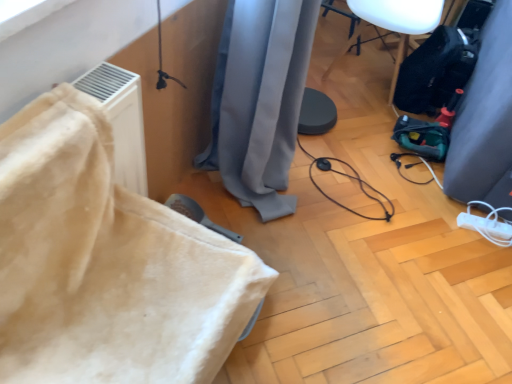
Question: In terms of height, does beige fabric couch at left, marked as the 1th furniture in a front-to-back arrangement, look taller or shorter compared to black plastic speaker at upper right, which is the 1th furniture from right to left?

Choices:
 (A) short
 (B) tall

Answer: (A)

Question: Is beige fabric couch at left, arranged as the first furniture when viewed from the left, in front of or behind black plastic speaker at upper right, positioned as the first furniture in back-to-front order, in the image?

Choices:
 (A) front
 (B) behind

Answer: (A)

Question: Which object is the farthest from the white plastic extension cord at lower right?

Choices:
 (A) gray fabric curtain at center, marked as the first curtain in a left-to-right arrangement
 (B) black plastic speaker at upper right, arranged as the 2th furniture when viewed from the left
 (C) beige fabric couch at left, marked as the 1th furniture in a front-to-back arrangement
 (D) black rubber cable at center
 (E) gray fabric curtain at right, the first curtain viewed from the right

Answer: (C)

Question: Estimate the real-world distances between objects in this image. Which object is closer to the black plastic speaker at upper right, positioned as the first furniture in back-to-front order?

Choices:
 (A) black rubber cable at center
 (B) gray fabric curtain at right, the first curtain viewed from the right
 (C) white plastic extension cord at lower right
 (D) gray fabric curtain at center, which appears as the second curtain when viewed from the right
 (E) beige fabric couch at left, which appears as the second furniture when viewed from the top

Answer: (B)